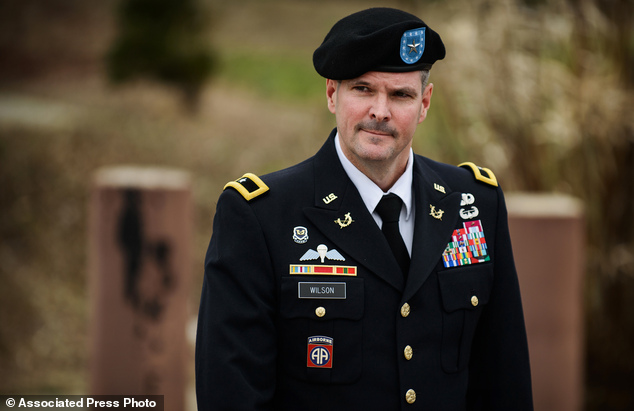
Identify the location of coat. This screenshot has width=634, height=411. (447, 353).